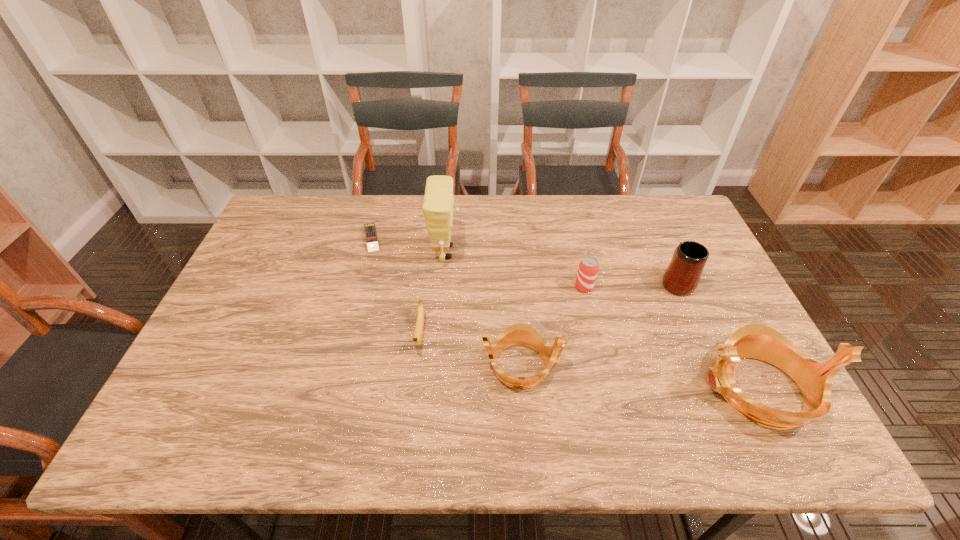
Considering the uniform spacing of tiaras, where should an additional tiara be positioned on the left? Please locate a free spot. Please provide its 2D coordinates. Your answer should be formatted as a tuple, i.e. [(x, y)], where the tuple contains the x and y coordinates of a point satisfying the conditions above.

[(305, 343)]